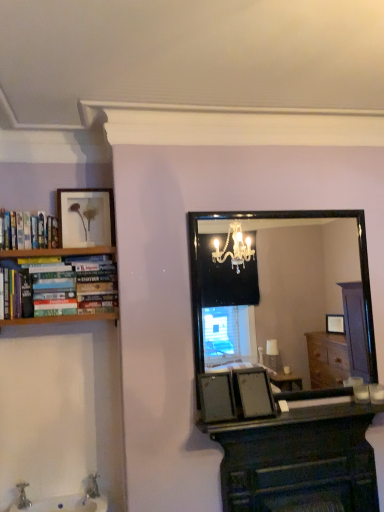
Question: From their relative heights in the image, would you say white glossy sink at lower left is taller or shorter than matte gold picture frame at upper left?

Choices:
 (A) short
 (B) tall

Answer: (A)

Question: Relative to matte gold picture frame at upper left, is white glossy sink at lower left in front or behind?

Choices:
 (A) behind
 (B) front

Answer: (B)

Question: Estimate the real-world distances between objects in this image. Which object is farther from the dark wood computer desk at center?

Choices:
 (A) hardcover books at left
 (B) matte gold picture frame at upper left
 (C) white glossy sink at lower left
 (D) smooth black countertop at lower center
 (E) black glass mirror at center

Answer: (E)

Question: Based on their relative distances, which object is nearer to the white glossy sink at lower left?

Choices:
 (A) matte gold picture frame at upper left
 (B) black glass mirror at center
 (C) dark wood computer desk at center
 (D) hardcover books at left
 (E) smooth black countertop at lower center

Answer: (E)